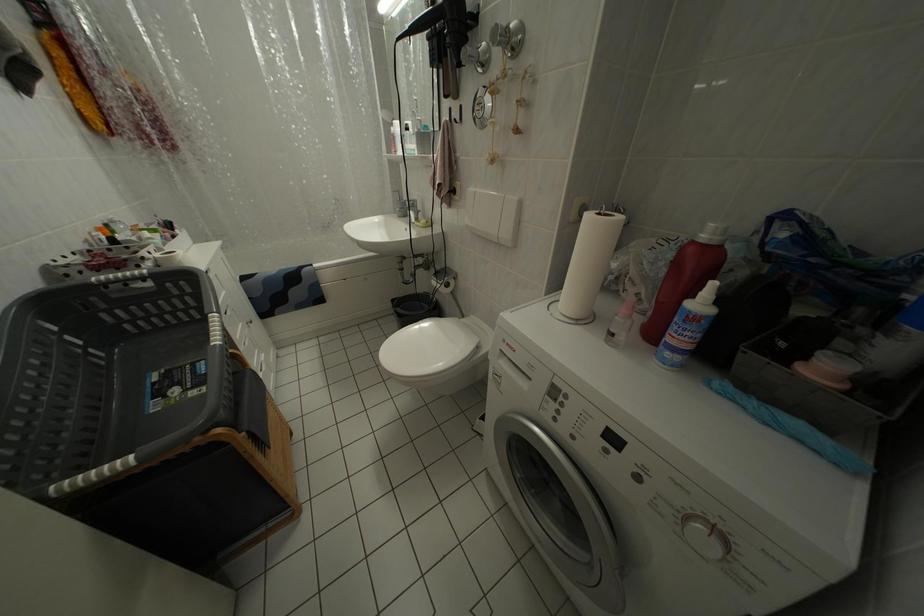
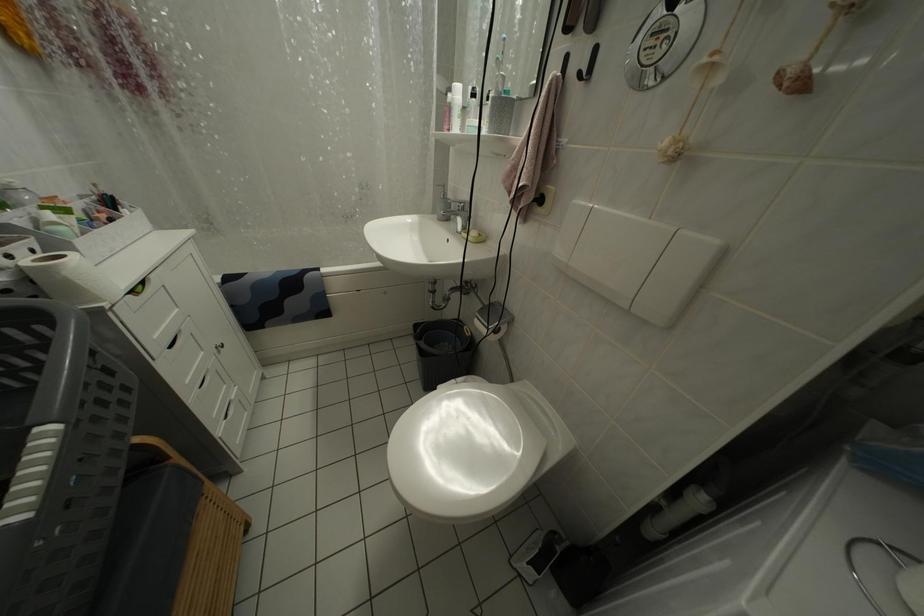
Question: The first image is from the beginning of the video and the second image is from the end. How did the camera likely rotate when shooting the video?

Choices:
 (A) Left
 (B) Right
 (C) Up
 (D) Down

Answer: (A)